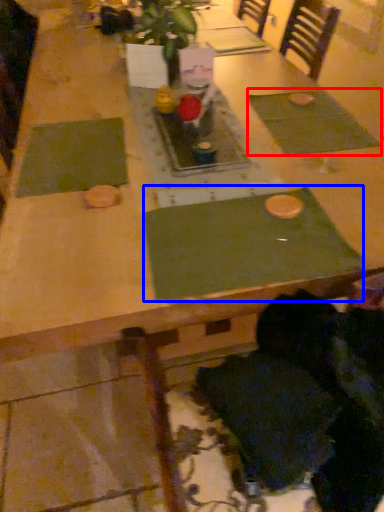
Question: Which object is closer to the camera taking this photo, place mat (highlighted by a red box) or place mat (highlighted by a blue box)?

Choices:
 (A) place mat
 (B) place mat

Answer: (B)